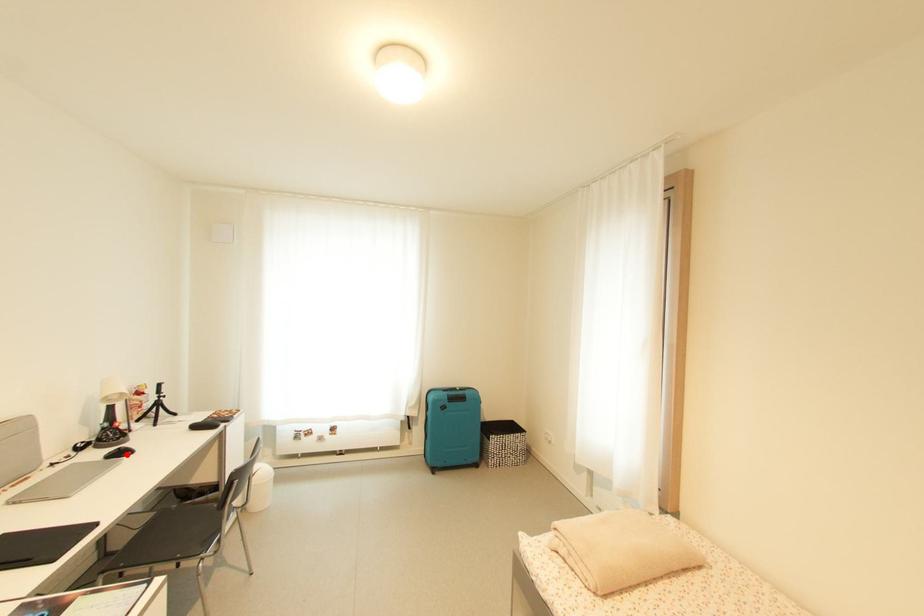
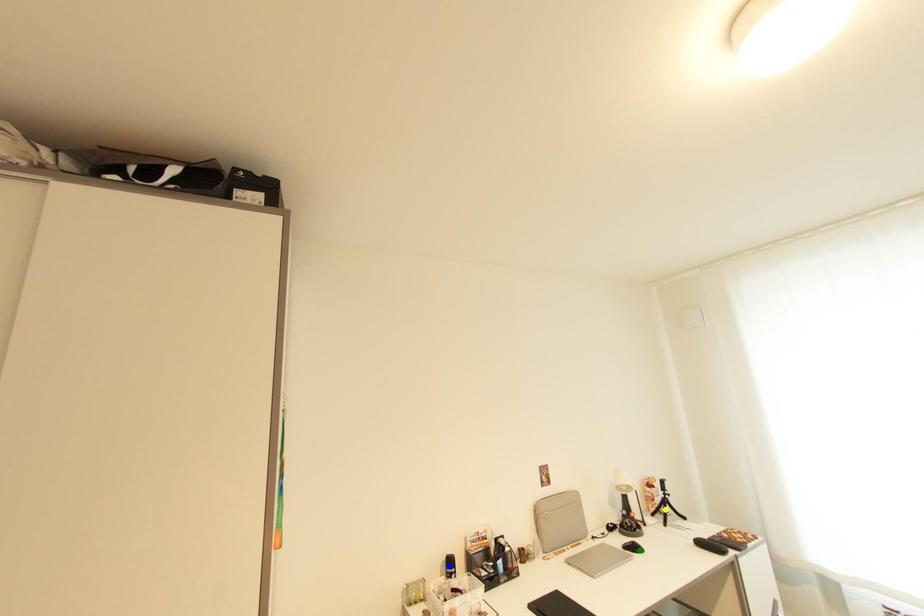
Question: I am providing you with two images of the same scene from different viewpoints. A red point is marked on the first image. You are given multiple points on the second image. Which point in image 2 represents the same 3d spot as the red point in image 1?

Choices:
 (A) green point
 (B) blue point
 (C) yellow point

Answer: (A)